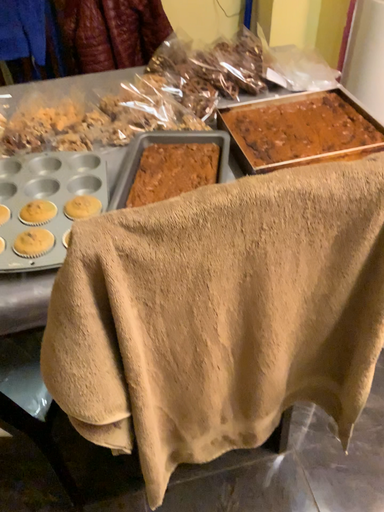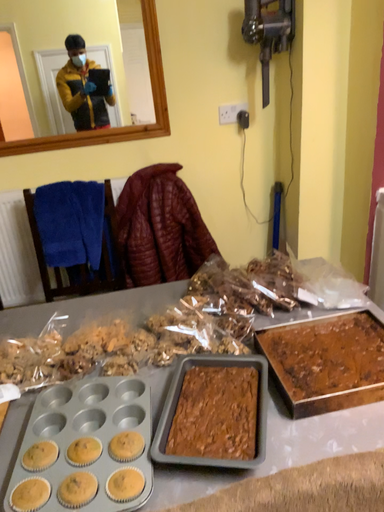
Question: How did the camera likely rotate when shooting the video?

Choices:
 (A) rotated downward
 (B) rotated upward

Answer: (B)